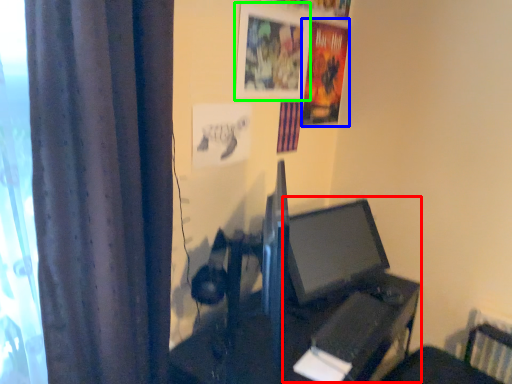
Question: Considering the real-world distances, which object is farthest from computer (highlighted by a red box)? poster page (highlighted by a blue box) or picture frame (highlighted by a green box)?

Choices:
 (A) poster page
 (B) picture frame

Answer: (B)